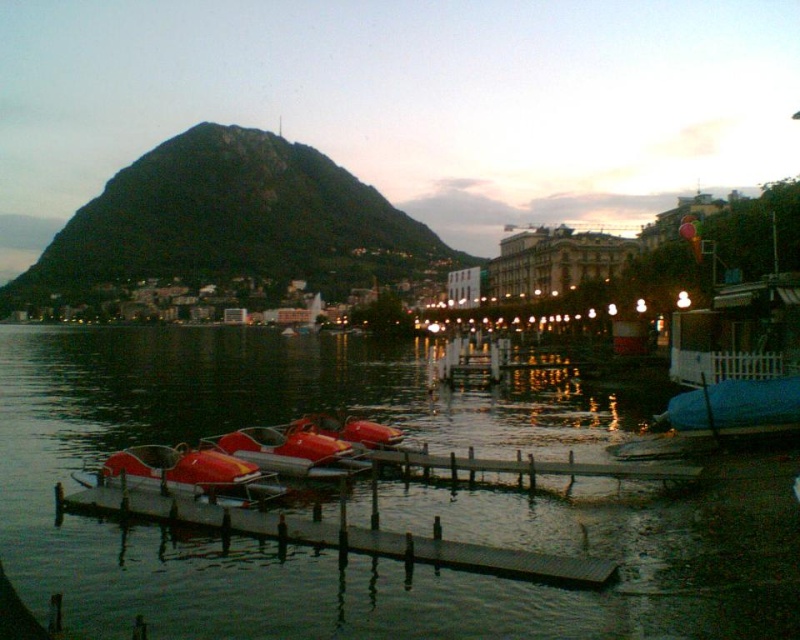
Question: Which of the following is the farthest from the observer?

Choices:
 (A) (564, 461)
 (B) (421, 420)
 (C) (381, 435)
 (D) (568, 576)

Answer: (B)

Question: Can you confirm if glossy water at center is bigger than smooth wooden dock at lower center?

Choices:
 (A) no
 (B) yes

Answer: (B)

Question: Estimate the real-world distances between objects in this image. Which object is closer to the smooth wooden dock at lower center?

Choices:
 (A) metallic red paddle boat at center
 (B) gray wooden dock at center
 (C) red rubber boat at center
 (D) shiny red pedal boat at lower left

Answer: (D)

Question: Can you confirm if metallic red paddle boat at center is positioned to the left of red rubber boat at center?

Choices:
 (A) yes
 (B) no

Answer: (A)

Question: In this image, where is smooth wooden dock at lower center located relative to gray wooden dock at center?

Choices:
 (A) below
 (B) above

Answer: (A)

Question: Which is nearer to the metallic red paddle boat at center?

Choices:
 (A) red rubber boat at center
 (B) smooth wooden dock at lower center

Answer: (A)